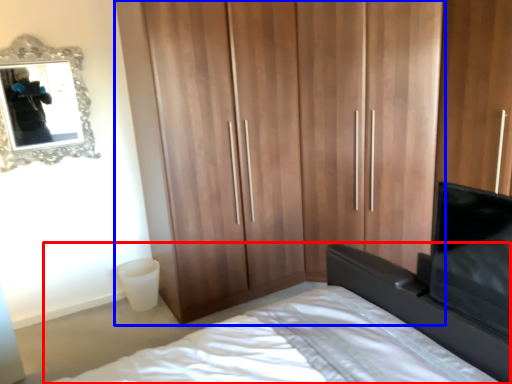
Question: Among these objects, which one is farthest to the camera, bed (highlighted by a red box) or cupboard (highlighted by a blue box)?

Choices:
 (A) bed
 (B) cupboard

Answer: (B)